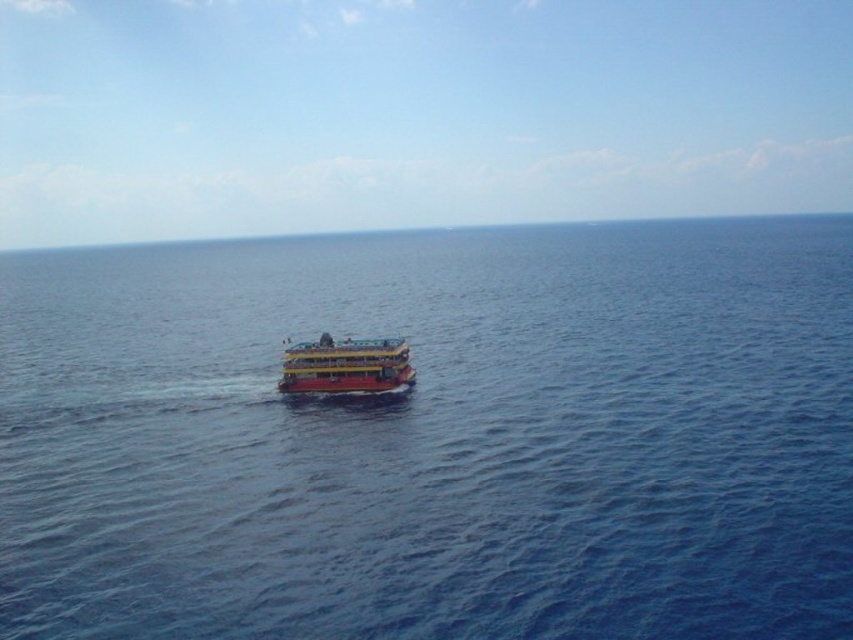
Question: Does blue water at center appear on the left side of yellow matte boat at center?

Choices:
 (A) no
 (B) yes

Answer: (A)

Question: Which point is farther to the camera?

Choices:
 (A) blue water at center
 (B) yellow matte boat at center

Answer: (B)

Question: Is blue water at center to the left of yellow matte boat at center from the viewer's perspective?

Choices:
 (A) no
 (B) yes

Answer: (A)

Question: Does blue water at center have a smaller size compared to yellow matte boat at center?

Choices:
 (A) no
 (B) yes

Answer: (A)